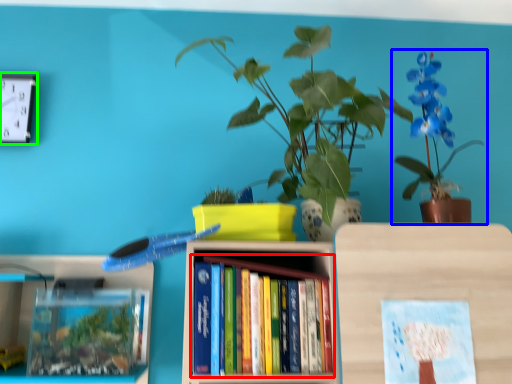
Question: Based on their relative distances, which object is nearer to book (highlighted by a red box)? Choose from houseplant (highlighted by a blue box) and clock (highlighted by a green box).

Choices:
 (A) houseplant
 (B) clock

Answer: (A)